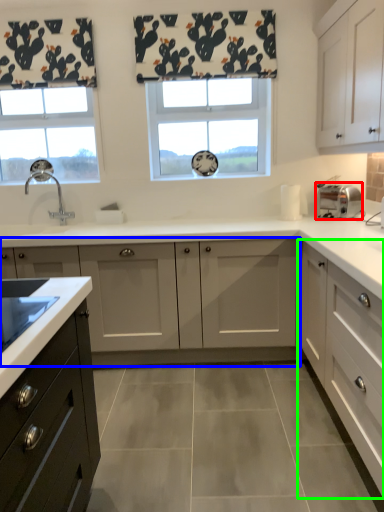
Question: Which object is the closest to the toaster (highlighted by a red box)? Choose among these: cabinetry (highlighted by a blue box) or cabinetry (highlighted by a green box).

Choices:
 (A) cabinetry
 (B) cabinetry

Answer: (B)